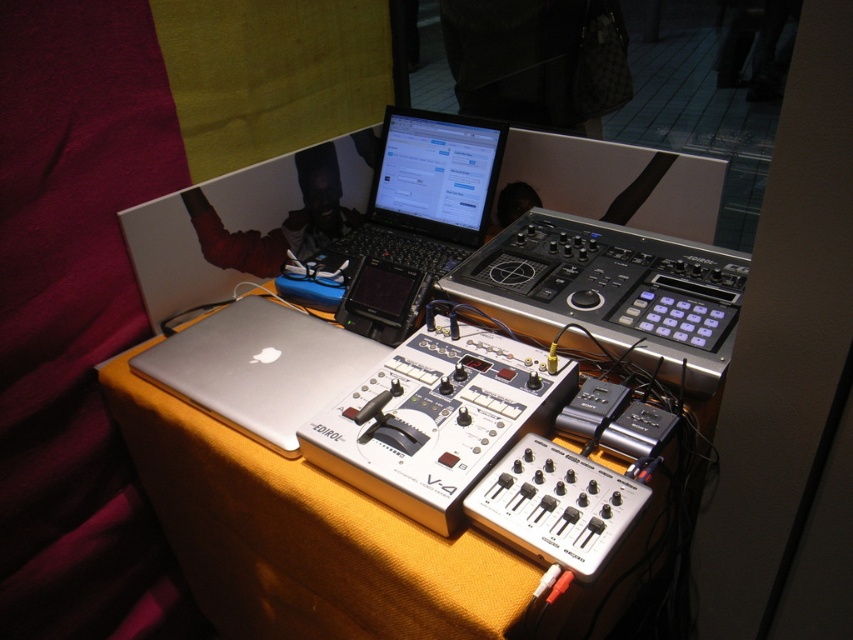
Question: Which object is the closest to the black plastic mixer at center?

Choices:
 (A) silver metallic table at center
 (B) silver metallic laptop at center
 (C) sleek black laptop at center

Answer: (C)

Question: Is the position of silver metallic table at center less distant than that of silver metallic laptop at center?

Choices:
 (A) no
 (B) yes

Answer: (B)

Question: Estimate the real-world distances between objects in this image. Which object is farther from the black plastic mixer at center?

Choices:
 (A) silver metallic mixer at center
 (B) sleek black laptop at center
 (C) silver metallic table at center
 (D) silver metallic laptop at center

Answer: (C)

Question: Is silver metallic table at center positioned before sleek black laptop at center?

Choices:
 (A) yes
 (B) no

Answer: (A)

Question: Which point is closer to the camera taking this photo?

Choices:
 (A) (146, 362)
 (B) (535, 216)

Answer: (A)

Question: Can you confirm if black plastic mixer at center is positioned to the right of sleek black laptop at center?

Choices:
 (A) yes
 (B) no

Answer: (A)